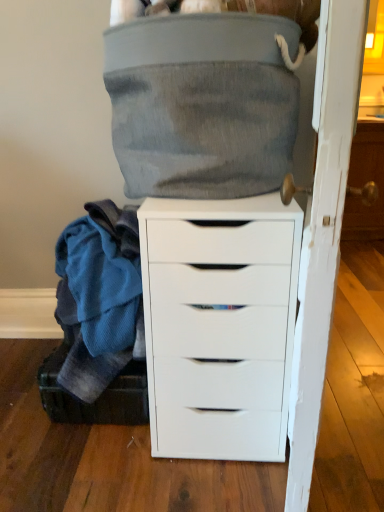
The image size is (384, 512). In order to click on space that is in front of black fabric shoe box at lower left in this screenshot , I will do `click(90, 477)`.